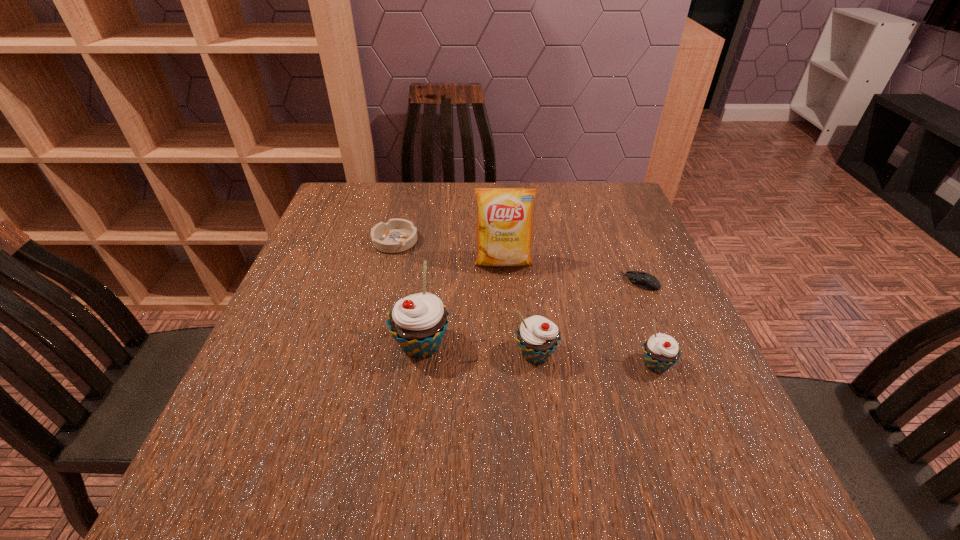
Image resolution: width=960 pixels, height=540 pixels. What are the coordinates of `vacant space that's between the shortest object and the third tallest object` in the screenshot? It's located at (588, 318).

Select which object appears as the fifth closest to the second shortest object. Please provide its 2D coordinates. Your answer should be formatted as a tuple, i.e. [(x, y)], where the tuple contains the x and y coordinates of a point satisfying the conditions above.

[(661, 351)]

Choose which object is the third nearest neighbor to the leftmost cupcake. Please provide its 2D coordinates. Your answer should be formatted as a tuple, i.e. [(x, y)], where the tuple contains the x and y coordinates of a point satisfying the conditions above.

[(397, 235)]

Select which cupcake appears as the second closest to the second shortest object. Please provide its 2D coordinates. Your answer should be formatted as a tuple, i.e. [(x, y)], where the tuple contains the x and y coordinates of a point satisfying the conditions above.

[(537, 337)]

Where is `cupcake identified as the third closest to the crisp (potato chip)`? Image resolution: width=960 pixels, height=540 pixels. cupcake identified as the third closest to the crisp (potato chip) is located at coordinates pos(661,351).

The image size is (960, 540). I want to click on free spot that satisfies the following two spatial constraints: 1. on the front-facing side of the rightmost cupcake; 2. on the right side of the crisp (potato chip), so click(x=510, y=364).

You are a GUI agent. You are given a task and a screenshot of the screen. Output one action in this format:
    pyautogui.click(x=<x>, y=<y>)
    Task: Click on the vacant point that satisfies the following two spatial constraints: 1. on the front-facing side of the crisp (potato chip); 2. on the right side of the third shortest object
    The height and width of the screenshot is (540, 960).
    Given the screenshot: What is the action you would take?
    pyautogui.click(x=510, y=364)

Find the location of a particular element. Image resolution: width=960 pixels, height=540 pixels. vacant space that satisfies the following two spatial constraints: 1. on the front-facing side of the computer mouse; 2. on the left side of the crisp (potato chip) is located at coordinates (505, 282).